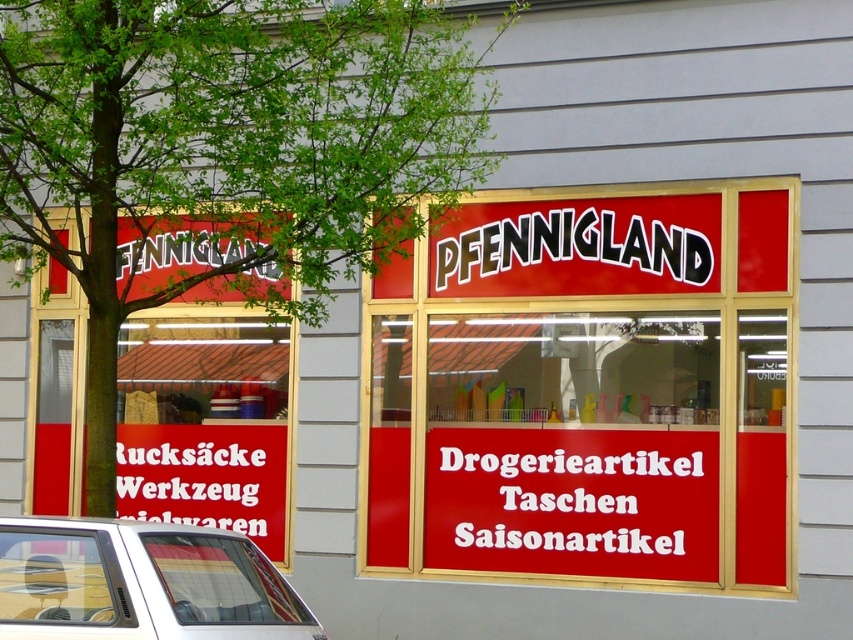
Question: Which object is farther from the camera taking this photo?

Choices:
 (A) green leafy tree at upper left
 (B) matte red signboard at center

Answer: (B)

Question: Which point is farther from the camera taking this photo?

Choices:
 (A) [x=225, y=81]
 (B) [x=184, y=422]

Answer: (B)

Question: Among these objects, which one is farthest from the camera?

Choices:
 (A) matte red signboard at center
 (B) white matte car at lower left

Answer: (A)

Question: Does red matte signboard at left have a larger size compared to white matte car at lower left?

Choices:
 (A) yes
 (B) no

Answer: (A)

Question: From the image, what is the correct spatial relationship of matte red signboard at center in relation to white matte car at lower left?

Choices:
 (A) right
 (B) left

Answer: (A)

Question: Can you confirm if matte red signboard at center is wider than green leafy tree at upper left?

Choices:
 (A) yes
 (B) no

Answer: (B)